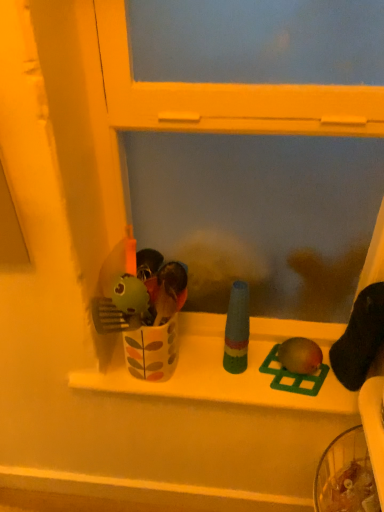
This screenshot has width=384, height=512. What are the coordinates of `free space to the left of matte green toy at center, which ranks as the 3th toy in left-to-right order` in the screenshot? It's located at click(229, 369).